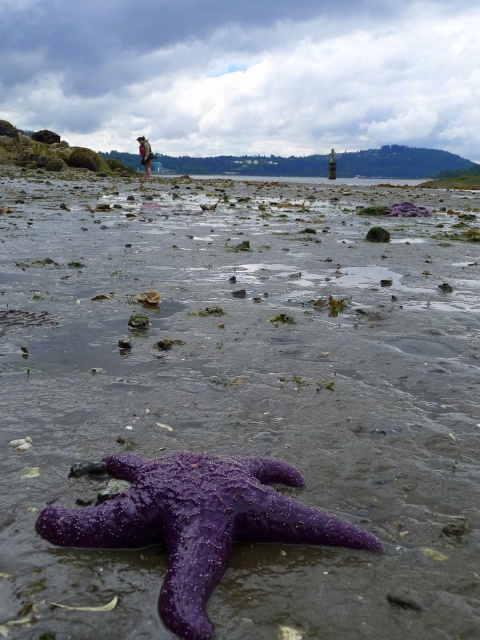
Can you confirm if purple rough starfish at lower center is positioned to the right of dark brown leather jacket at upper left?

Yes, purple rough starfish at lower center is to the right of dark brown leather jacket at upper left.

Between point (105, 516) and point (152, 157), which one is positioned behind?

Positioned behind is point (152, 157).

Does point (117, 522) lie behind point (144, 152)?

No, (117, 522) is closer to viewer.

At what (x,y) coordinates should I click in order to perform the action: click on purple rough starfish at lower center. Please return your answer as a coordinate pair (x, y). The width and height of the screenshot is (480, 640). Looking at the image, I should click on (197, 522).

In the scene shown: Between purple wet mud at center and dark brown leather jacket at upper left, which one is positioned higher?

dark brown leather jacket at upper left

Based on the photo, which of these two, purple wet mud at center or dark brown leather jacket at upper left, stands shorter?

dark brown leather jacket at upper left

Is point (72, 396) positioned after point (139, 141)?

No, (72, 396) is in front of (139, 141).

This screenshot has width=480, height=640. What are the coordinates of `purple wet mud at center` in the screenshot? It's located at (243, 396).

Between purple wet mud at center and purple rough starfish at lower center, which one appears on the left side from the viewer's perspective?

Positioned to the left is purple wet mud at center.

Describe the element at coordinates (243, 396) in the screenshot. I see `purple wet mud at center` at that location.

This screenshot has height=640, width=480. What are the coordinates of `purple wet mud at center` in the screenshot? It's located at click(243, 396).